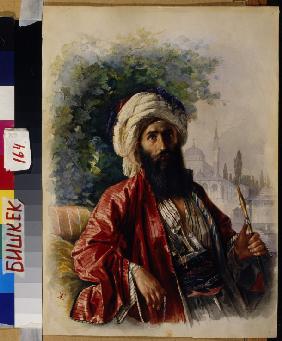
Locate an element on the screen. masking tape is located at coordinates (34, 7), (12, 234).